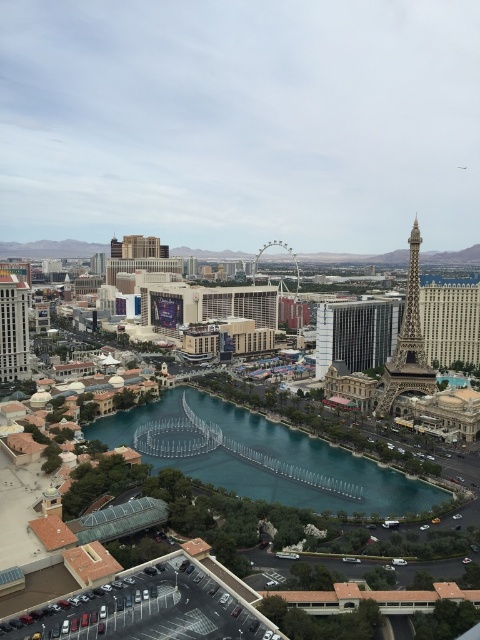
Is reflective glass fountain at center taller than green glass river at center?

Yes, reflective glass fountain at center is taller than green glass river at center.

Between point (245, 588) and point (144, 438), which one is positioned in front?

Positioned in front is point (245, 588).

Is point (387, 611) more distant than point (356, 467)?

No, it is in front of (356, 467).

Where is `reflective glass fountain at center`? reflective glass fountain at center is located at coordinates (91, 561).

Who is positioned more to the right, green glass river at center or shiny gold eiffel tower at right?

shiny gold eiffel tower at right is more to the right.

Which is more to the left, green glass river at center or shiny gold eiffel tower at right?

From the viewer's perspective, green glass river at center appears more on the left side.

Find the location of a particular element. Image resolution: width=480 pixels, height=640 pixels. green glass river at center is located at coordinates (262, 458).

Is green glass river at center to the left of matte silver hotel at left from the viewer's perspective?

In fact, green glass river at center is to the right of matte silver hotel at left.

Is green glass river at center smaller than matte silver hotel at left?

Incorrect, green glass river at center is not smaller in size than matte silver hotel at left.

Locate an element on the screen. This screenshot has height=640, width=480. green glass river at center is located at coordinates (262, 458).

Image resolution: width=480 pixels, height=640 pixels. In order to click on green glass river at center in this screenshot , I will do `click(262, 458)`.